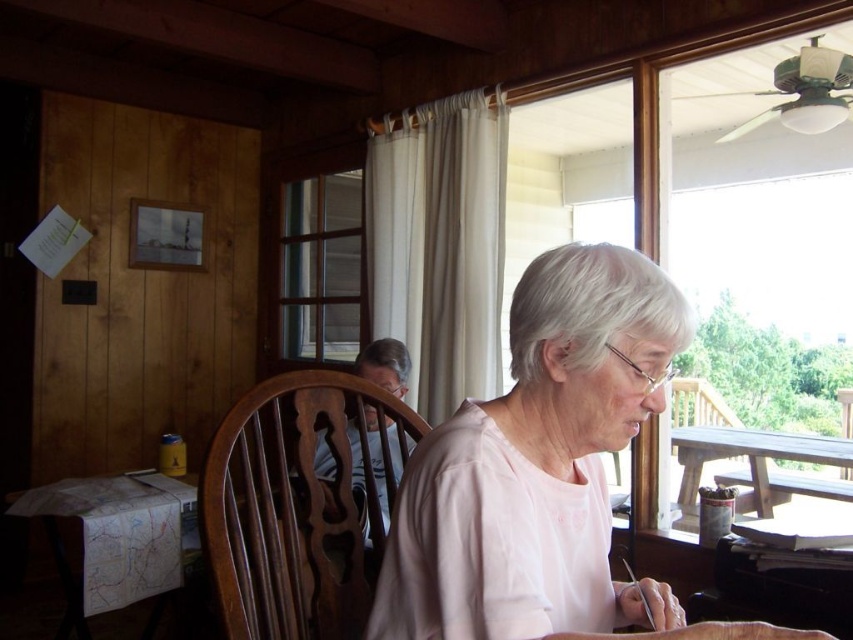
Question: Which point is closer to the camera taking this photo?

Choices:
 (A) (496, 637)
 (B) (102, 582)

Answer: (A)

Question: Among these objects, which one is nearest to the camera?

Choices:
 (A) pink fabric at center
 (B) white paper map at lower left
 (C) wooden picnic table at right

Answer: (A)

Question: Can you confirm if pink fabric at center is bigger than wooden picnic table at right?

Choices:
 (A) no
 (B) yes

Answer: (A)

Question: Which point appears closest to the camera in this image?

Choices:
 (A) (117, 532)
 (B) (683, 432)
 (C) (515, 300)

Answer: (C)

Question: Can you confirm if pink fabric at center is smaller than white paper map at lower left?

Choices:
 (A) yes
 (B) no

Answer: (A)

Question: Does white paper map at lower left have a larger size compared to wooden picnic table at right?

Choices:
 (A) no
 (B) yes

Answer: (B)